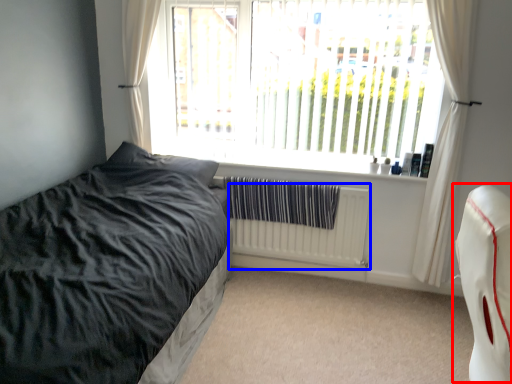
Question: Which object appears closest to the camera in this image, swivel chair (highlighted by a red box) or radiator (highlighted by a blue box)?

Choices:
 (A) swivel chair
 (B) radiator

Answer: (A)